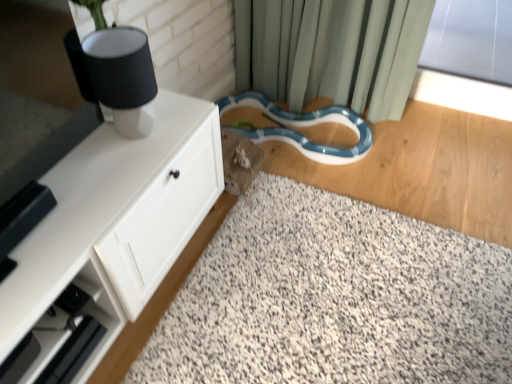
Question: Can you confirm if black matte table lamp at upper left is bigger than blue glossy snake at lower center?

Choices:
 (A) no
 (B) yes

Answer: (A)

Question: Considering the relative sizes of black matte table lamp at upper left and blue glossy snake at lower center in the image provided, is black matte table lamp at upper left wider than blue glossy snake at lower center?

Choices:
 (A) yes
 (B) no

Answer: (B)

Question: Is black matte table lamp at upper left not near blue glossy snake at lower center?

Choices:
 (A) no
 (B) yes

Answer: (A)

Question: Is the depth of black matte table lamp at upper left greater than that of blue glossy snake at lower center?

Choices:
 (A) no
 (B) yes

Answer: (A)

Question: Is blue glossy snake at lower center at the back of black matte table lamp at upper left?

Choices:
 (A) yes
 (B) no

Answer: (B)

Question: Looking at their shapes, would you say white matte cabinet at left is wider or thinner than white speckled carpet at center?

Choices:
 (A) wide
 (B) thin

Answer: (B)

Question: Is white matte cabinet at left inside the boundaries of white speckled carpet at center, or outside?

Choices:
 (A) inside
 (B) outside

Answer: (B)

Question: In the image, is white matte cabinet at left positioned in front of or behind white speckled carpet at center?

Choices:
 (A) front
 (B) behind

Answer: (A)

Question: Would you say white matte cabinet at left is to the left or to the right of white speckled carpet at center in the picture?

Choices:
 (A) right
 (B) left

Answer: (B)

Question: Considering the positions of black matte table lamp at upper left and white speckled carpet at center in the image, is black matte table lamp at upper left wider or thinner than white speckled carpet at center?

Choices:
 (A) thin
 (B) wide

Answer: (A)

Question: Would you say black matte table lamp at upper left is inside or outside white speckled carpet at center?

Choices:
 (A) inside
 (B) outside

Answer: (B)

Question: In the image, is black matte table lamp at upper left positioned in front of or behind white speckled carpet at center?

Choices:
 (A) behind
 (B) front

Answer: (A)

Question: From a real-world perspective, relative to white speckled carpet at center, is black matte table lamp at upper left vertically above or below?

Choices:
 (A) below
 (B) above

Answer: (B)

Question: In terms of size, does white matte cabinet at left appear bigger or smaller than black matte table lamp at upper left?

Choices:
 (A) small
 (B) big

Answer: (B)

Question: Considering their positions, is white matte cabinet at left located in front of or behind black matte table lamp at upper left?

Choices:
 (A) behind
 (B) front

Answer: (B)